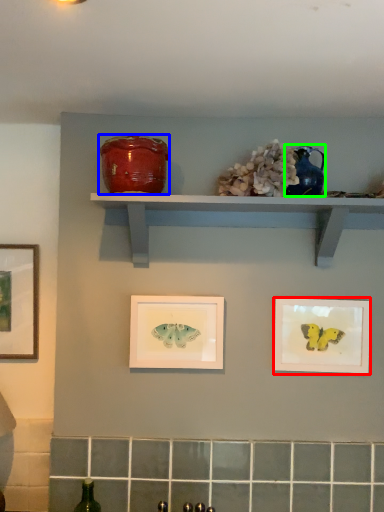
Question: Which object is positioned farthest from picture frame (highlighted by a red box)? Select from pottery (highlighted by a blue box) and teal (highlighted by a green box).

Choices:
 (A) pottery
 (B) teal

Answer: (A)